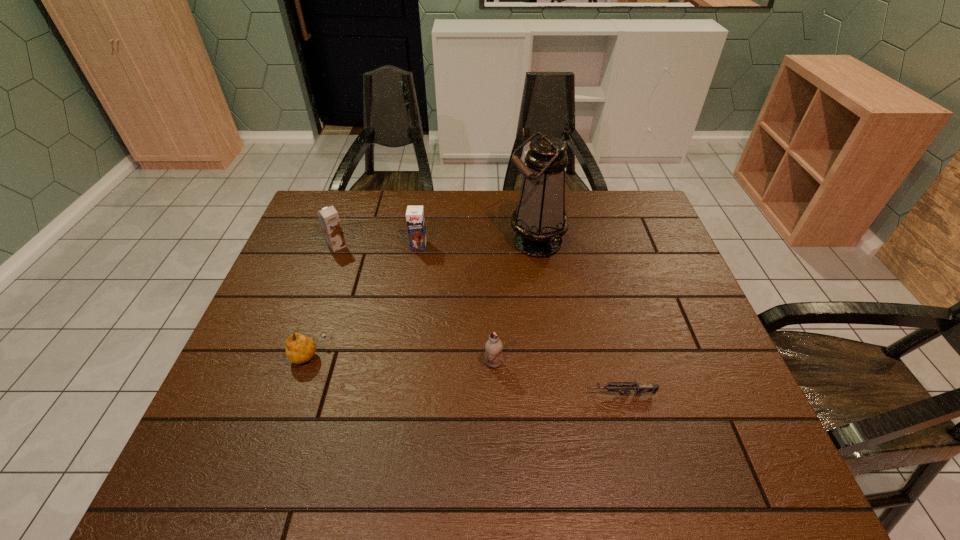
Locate an element on the screen. the tallest object is located at coordinates (540, 221).

The width and height of the screenshot is (960, 540). In order to click on the leftmost chocolate milk in this screenshot , I will do `click(328, 216)`.

This screenshot has height=540, width=960. In order to click on the fourth object from right to left in this screenshot , I will do `click(415, 219)`.

The width and height of the screenshot is (960, 540). In order to click on the rightmost chocolate milk in this screenshot , I will do `click(494, 346)`.

Where is `the shortest chocolate milk`? The width and height of the screenshot is (960, 540). the shortest chocolate milk is located at coordinates pos(494,346).

Image resolution: width=960 pixels, height=540 pixels. I want to click on the fifth tallest object, so click(300, 348).

This screenshot has height=540, width=960. Find the location of `the shortest object`. the shortest object is located at coordinates (640, 389).

The width and height of the screenshot is (960, 540). What are the coordinates of `gun` in the screenshot? It's located at (640, 389).

In order to click on free spot located 0.090m on the left of the oil lamp in this screenshot , I will do point(478,242).

Locate an element on the screen. The image size is (960, 540). vacant space situated 0.240m on the front of the leftmost chocolate milk is located at coordinates (313, 313).